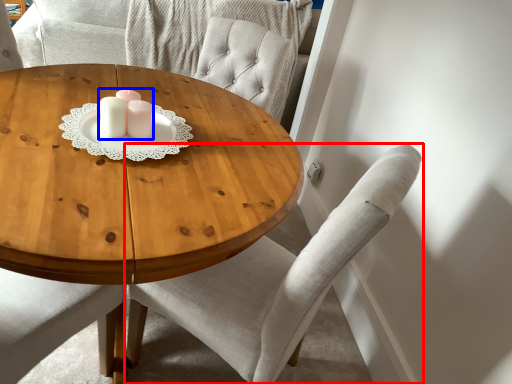
Question: Which object appears closest to the camera in this image, chair (highlighted by a red box) or candle holder (highlighted by a blue box)?

Choices:
 (A) chair
 (B) candle holder

Answer: (A)